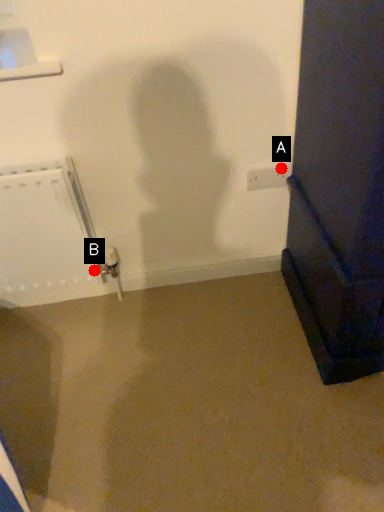
Question: Two points are circled on the image, labeled by A and B beside each circle. Which point is farther from the camera taking this photo?

Choices:
 (A) A is further
 (B) B is further

Answer: (B)